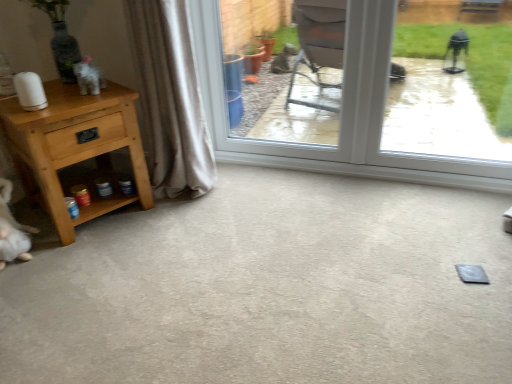
Identify the location of free space in front of white glossy elephant at upper left. The width and height of the screenshot is (512, 384). (68, 105).